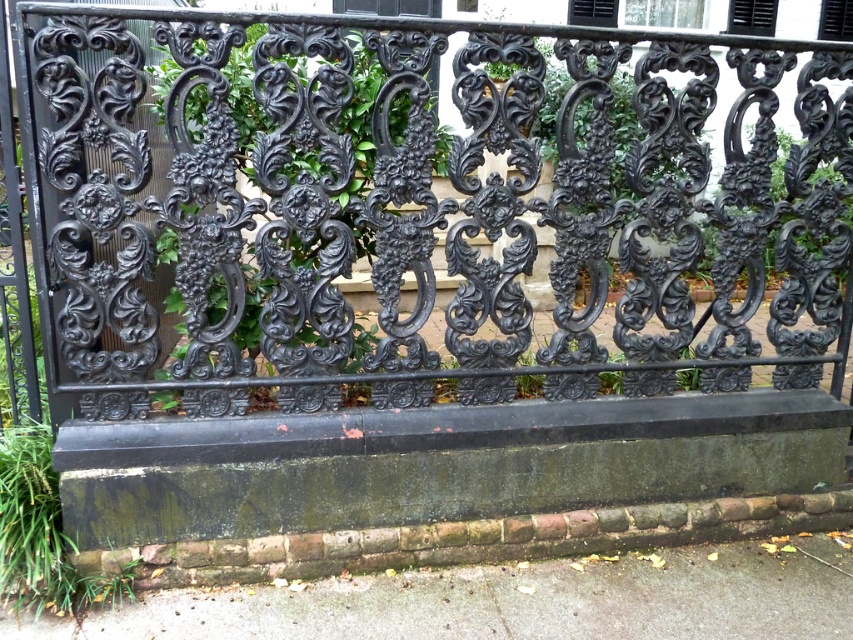
Question: Where is black wrought iron fence at center located in relation to gray concrete pavement at lower center in the image?

Choices:
 (A) left
 (B) right

Answer: (A)

Question: Which of the following is the closest to the observer?

Choices:
 (A) (788, 593)
 (B) (340, 323)

Answer: (B)

Question: Is the position of black wrought iron fence at center more distant than that of gray concrete pavement at lower center?

Choices:
 (A) no
 (B) yes

Answer: (A)

Question: Can you confirm if black wrought iron fence at center is positioned to the left of gray concrete pavement at lower center?

Choices:
 (A) no
 (B) yes

Answer: (B)